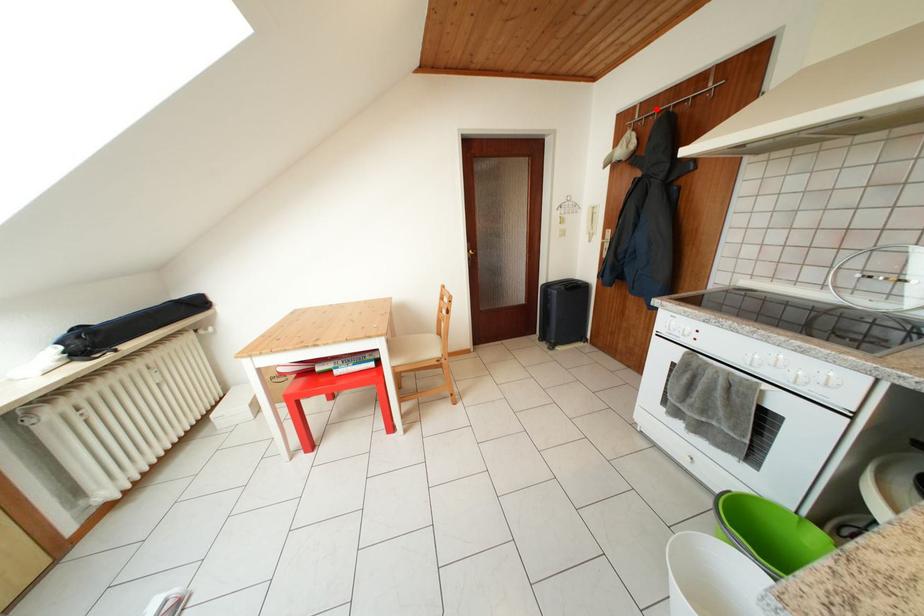
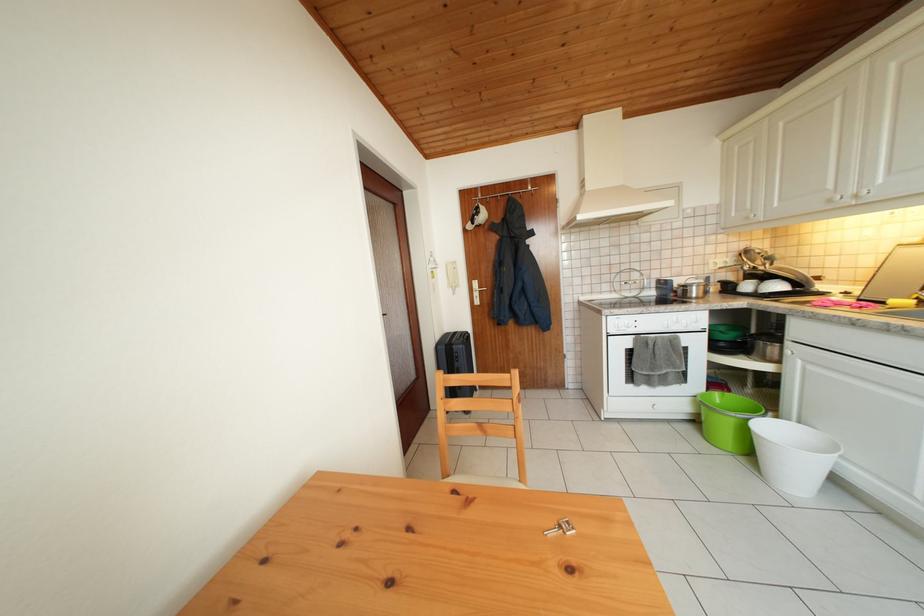
Question: I am providing you with two images of the same scene from different viewpoints. Given a red point in image1, look at the same physical point in image2. Is it:

Choices:
 (A) Closer to the viewpoint
 (B) Farther from the viewpoint

Answer: (A)